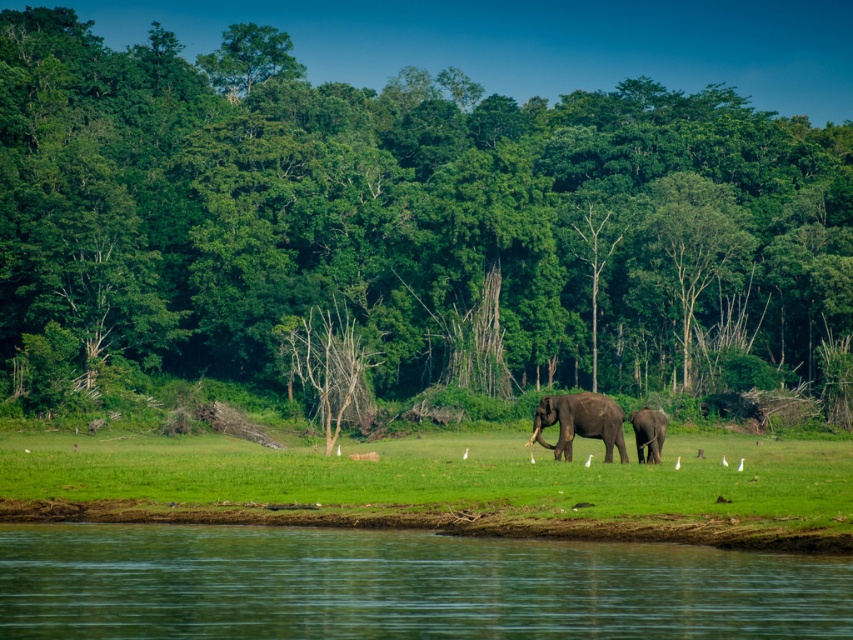
Is point (508, 547) farther from viewer compared to point (567, 445)?

That is False.

At what (x,y) coordinates should I click in order to perform the action: click on green smooth water at lower center. Please return your answer as a coordinate pair (x, y). The height and width of the screenshot is (640, 853). Looking at the image, I should click on (399, 586).

Can you confirm if green grassy field at center is positioned to the right of brown textured elephant at center?

No, green grassy field at center is not to the right of brown textured elephant at center.

Is green grassy field at center positioned in front of brown textured elephant at center?

Yes, it is in front of brown textured elephant at center.

You are a GUI agent. You are given a task and a screenshot of the screen. Output one action in this format:
    pyautogui.click(x=<x>, y=<y>)
    Task: Click on the green grassy field at center
    This screenshot has height=640, width=853.
    Given the screenshot: What is the action you would take?
    pyautogui.click(x=440, y=476)

Does green leafy tree at center have a greater width compared to gray textured elephant at center?

Yes.

The width and height of the screenshot is (853, 640). Identify the location of green leafy tree at center. (409, 224).

Locate an element on the screen. The height and width of the screenshot is (640, 853). green leafy tree at center is located at coordinates (409, 224).